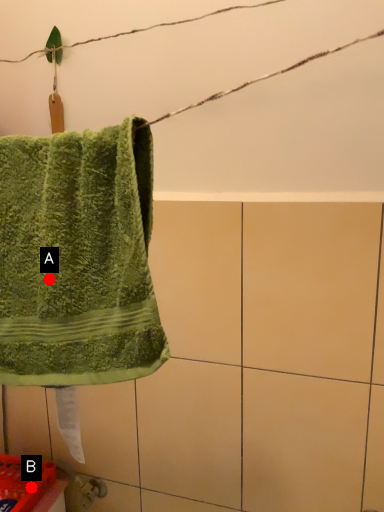
Question: Two points are circled on the image, labeled by A and B beside each circle. Which point is farther to the camera?

Choices:
 (A) A is further
 (B) B is further

Answer: (B)